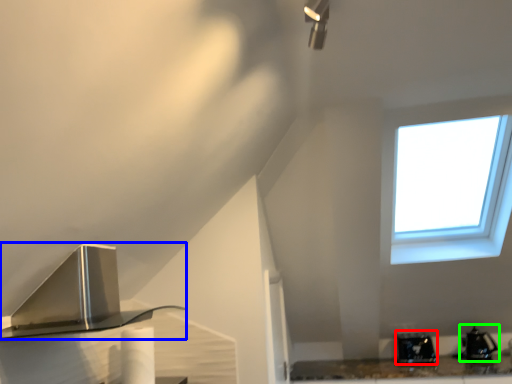
Question: Considering the real-world distances, which object is farthest from appliance (highlighted by a red box)? kitchen appliance (highlighted by a blue box) or appliance (highlighted by a green box)?

Choices:
 (A) kitchen appliance
 (B) appliance

Answer: (A)